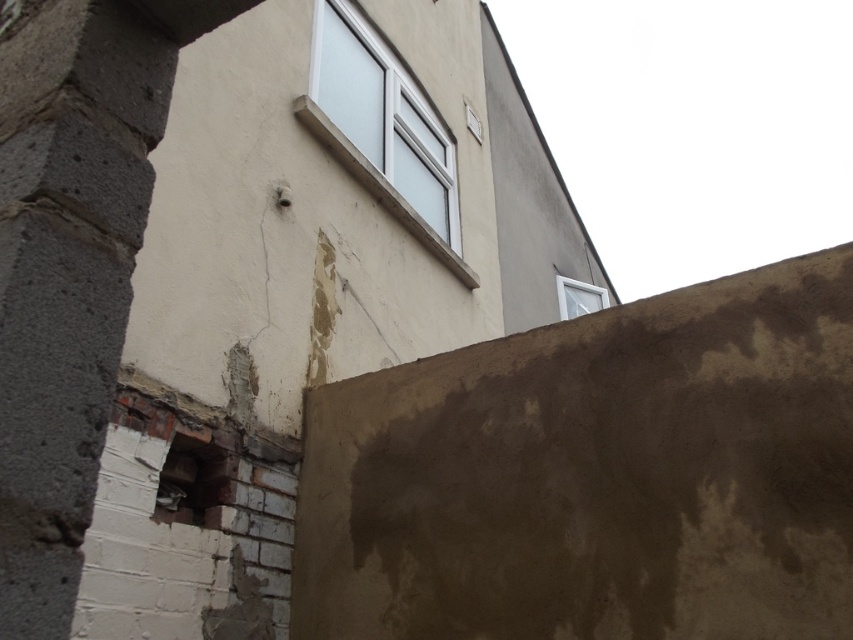
Who is lower down, white frosted glass window at upper center or white plastic window at upper right?

white plastic window at upper right

Is white frosted glass window at upper center shorter than white plastic window at upper right?

Incorrect, white frosted glass window at upper center's height does not fall short of white plastic window at upper right's.

Locate an element on the screen. white frosted glass window at upper center is located at coordinates (381, 131).

The image size is (853, 640). Identify the location of white frosted glass window at upper center. (381, 131).